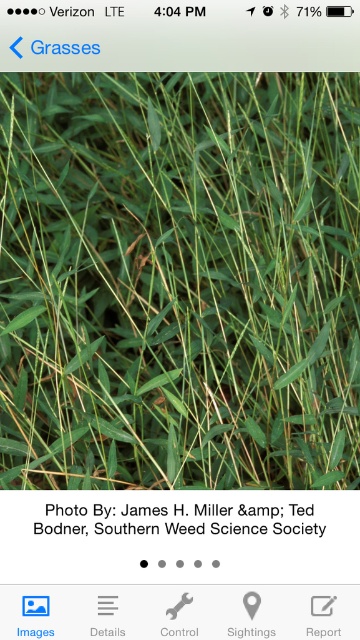
You are using a plant identification app and see the green matte grass at center and the black paper at center in the image. Which object is taller?

The green matte grass at center is taller than the black paper at center.

You are holding a phone with the plant identification app open. The app requires you to position the green matte grass at center within the camera frame for analysis. If your phone camera is 1.36 meters away from the grass, will the grass be in focus? Assume the camera has a minimum focus distance of 0.5 meters and can focus on objects up to 5 meters away.

The green matte grass at center and camera are 1.36 meters apart. Since the phone camera can focus on objects between 0.5 meters and 5 meters away, the grass will be in focus because 1.36 meters falls within that range.

You are using a plant identification app and see two points on the screen. The first point is at coordinates point (x=167, y=138) and the second is at point (x=52, y=528). Which point is closer to you?

Point (x=167, y=138) is further to the viewer than point (x=52, y=528), so the point closer to you is point (x=52, y=528).